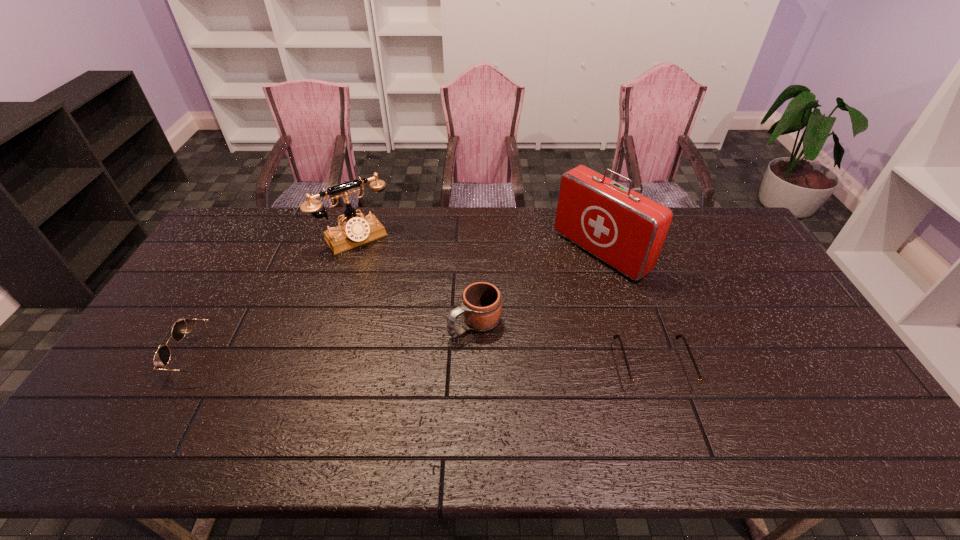
Find the location of a particular element. The image size is (960, 540). telephone that is positioned at the far edge is located at coordinates (355, 231).

Locate an element on the screen. object positioned at the near edge is located at coordinates (642, 386).

At what (x,y) coordinates should I click in order to perform the action: click on object located at the left edge. Please return your answer as a coordinate pair (x, y). Looking at the image, I should click on (161, 359).

Identify the location of vacant space at the far edge of the desktop. The height and width of the screenshot is (540, 960). (564, 244).

Find the location of `vacant position at the near edge of the desktop`. vacant position at the near edge of the desktop is located at coordinates (353, 383).

Image resolution: width=960 pixels, height=540 pixels. Identify the location of vacant space at the left edge of the desktop. (171, 361).

Identify the location of vacant space at the right edge of the desktop. (734, 272).

You are a GUI agent. You are given a task and a screenshot of the screen. Output one action in this format:
    pyautogui.click(x=<x>, y=<y>)
    Task: Click on the vacant space at the far right corner of the desktop
    
    Given the screenshot: What is the action you would take?
    pyautogui.click(x=738, y=238)

The width and height of the screenshot is (960, 540). I want to click on free space that is in between the sunglasses and the shortest object, so click(430, 361).

Where is `vacant area that lies between the shortest object and the third tallest object`? The width and height of the screenshot is (960, 540). vacant area that lies between the shortest object and the third tallest object is located at coordinates tap(564, 345).